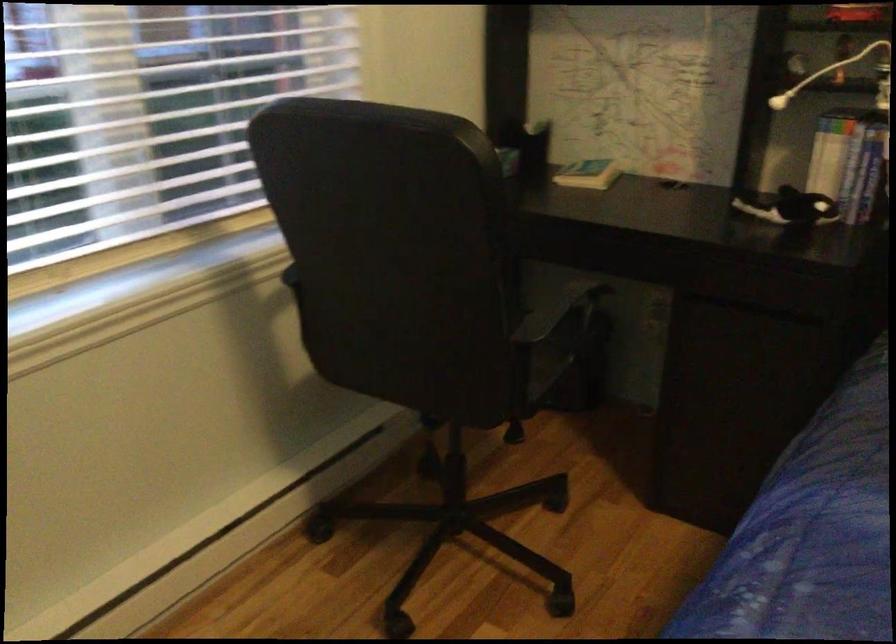
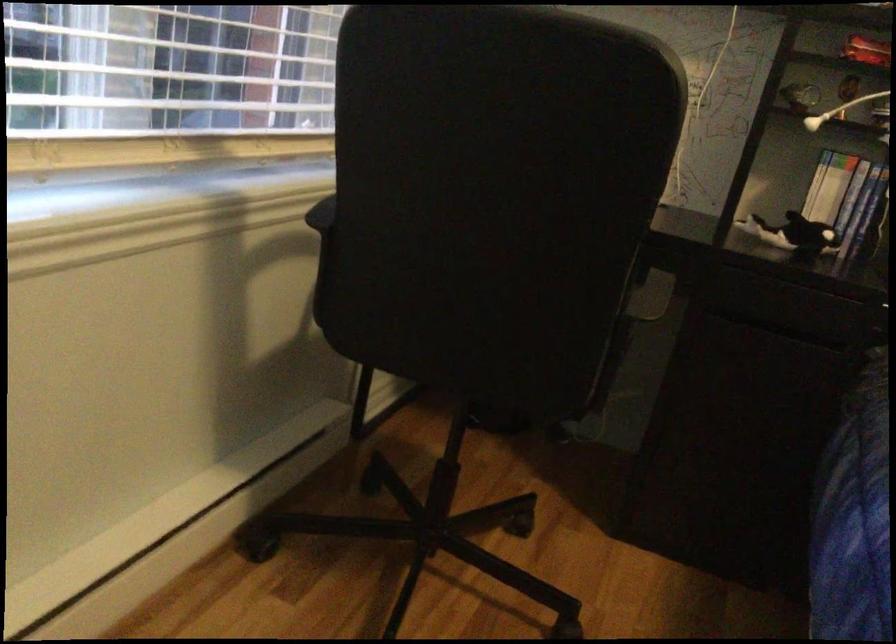
Question: The camera is either moving clockwise (left) or counter-clockwise (right) around the object. The first image is from the beginning of the video and the second image is from the end. Is the camera moving left or right when shooting the video?

Choices:
 (A) Left
 (B) Right

Answer: (A)